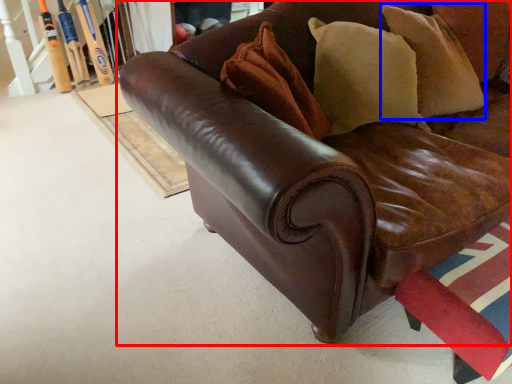
Question: Which object appears closest to the camera in this image, studio couch (highlighted by a red box) or pillow (highlighted by a blue box)?

Choices:
 (A) studio couch
 (B) pillow

Answer: (A)